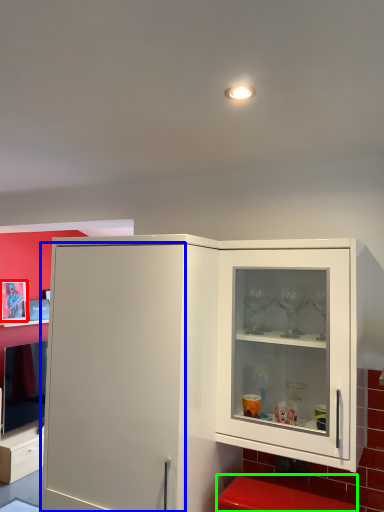
Question: Which is nearer to the picture frame (highlighted by a red box)? door (highlighted by a blue box) or step stool (highlighted by a green box).

Choices:
 (A) door
 (B) step stool

Answer: (A)